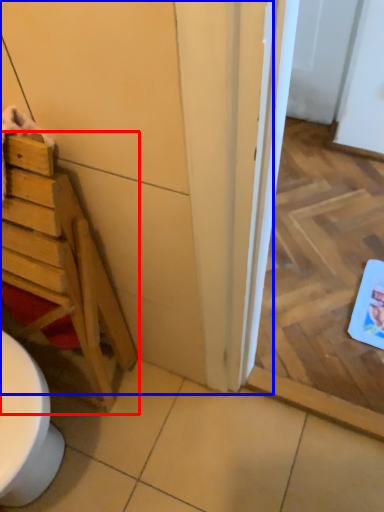
Question: Which object appears farthest to the camera in this image, furniture (highlighted by a red box) or door (highlighted by a blue box)?

Choices:
 (A) furniture
 (B) door

Answer: (A)